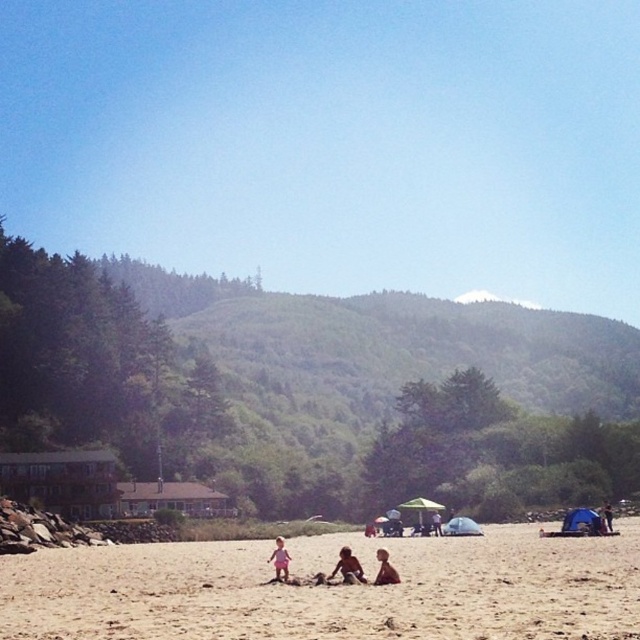
Question: Does smooth sand at center lie behind smooth beige sand at center?

Choices:
 (A) no
 (B) yes

Answer: (A)

Question: Based on their relative distances, which object is nearer to the smooth beige sand at center?

Choices:
 (A) smooth sand at center
 (B) light brown skin at center
 (C) pink fabric at center

Answer: (C)

Question: Is beige sandy beach at center bigger than smooth beige sand at center?

Choices:
 (A) yes
 (B) no

Answer: (A)

Question: Which point is closer to the camera?

Choices:
 (A) smooth sand at center
 (B) light brown skin at center

Answer: (B)

Question: Does smooth sand at center appear over light brown skin at center?

Choices:
 (A) no
 (B) yes

Answer: (B)

Question: Which of the following is the farthest from the observer?

Choices:
 (A) smooth beige sand at center
 (B) beige sandy beach at center
 (C) light brown skin at center

Answer: (A)